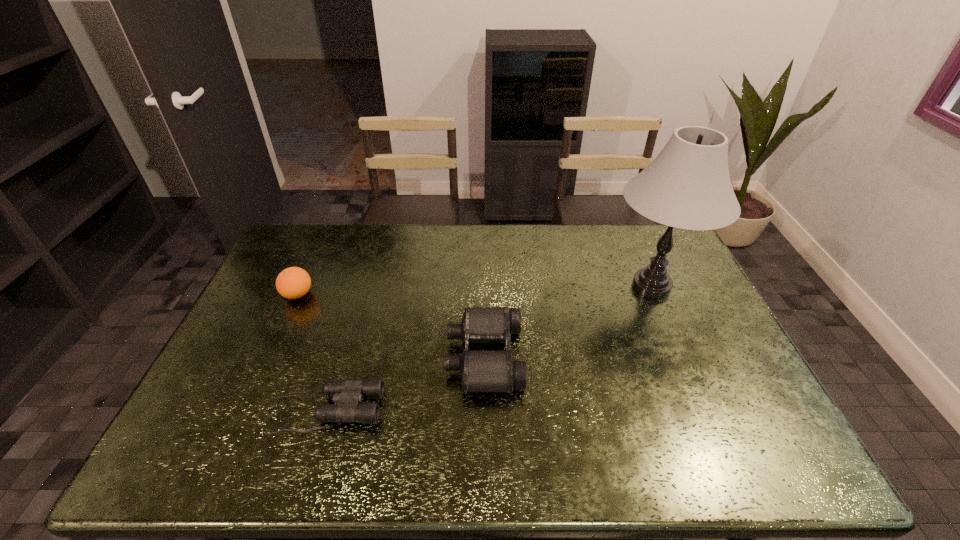
You are a GUI agent. You are given a task and a screenshot of the screen. Output one action in this format:
    pyautogui.click(x=<x>, y=<y>)
    Task: Click on the tallest object
    The image size is (960, 540).
    Given the screenshot: What is the action you would take?
    pyautogui.click(x=687, y=186)

Find the location of a particular element. This screenshot has height=540, width=960. the rightmost object is located at coordinates (687, 186).

The height and width of the screenshot is (540, 960). I want to click on orange, so click(x=292, y=283).

Locate an element on the screen. the third object from left to right is located at coordinates (481, 371).

Identify the location of the right binoculars. Image resolution: width=960 pixels, height=540 pixels. (481, 371).

Where is `the third object from right to left`? The height and width of the screenshot is (540, 960). the third object from right to left is located at coordinates (348, 394).

The width and height of the screenshot is (960, 540). Find the location of `the shorter binoculars`. the shorter binoculars is located at coordinates (348, 394).

In order to click on vacant space located on the front of the lamp in this screenshot , I will do `click(691, 379)`.

The width and height of the screenshot is (960, 540). What are the coordinates of `free space located on the right of the orange` in the screenshot? It's located at (401, 295).

Where is `free space located 0.310m through the eyepieces of the third object from left to right`? Image resolution: width=960 pixels, height=540 pixels. free space located 0.310m through the eyepieces of the third object from left to right is located at coordinates (335, 356).